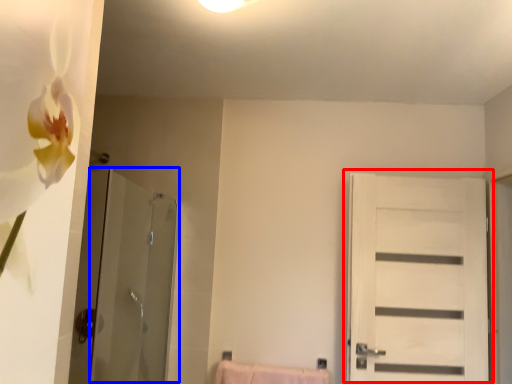
Question: Which point is further to the camera, door (highlighted by a red box) or screen door (highlighted by a blue box)?

Choices:
 (A) door
 (B) screen door

Answer: (A)